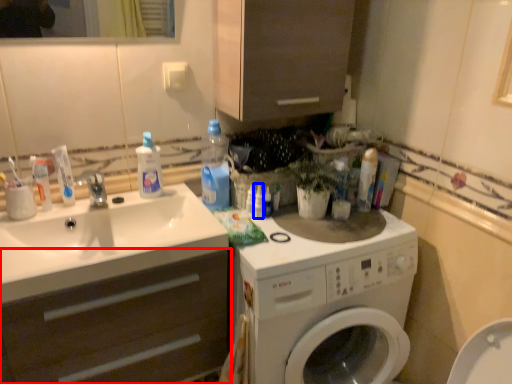
Question: Which object is further to the camera taking this photo, bathroom cabinet (highlighted by a red box) or cleaning product (highlighted by a blue box)?

Choices:
 (A) bathroom cabinet
 (B) cleaning product

Answer: (B)